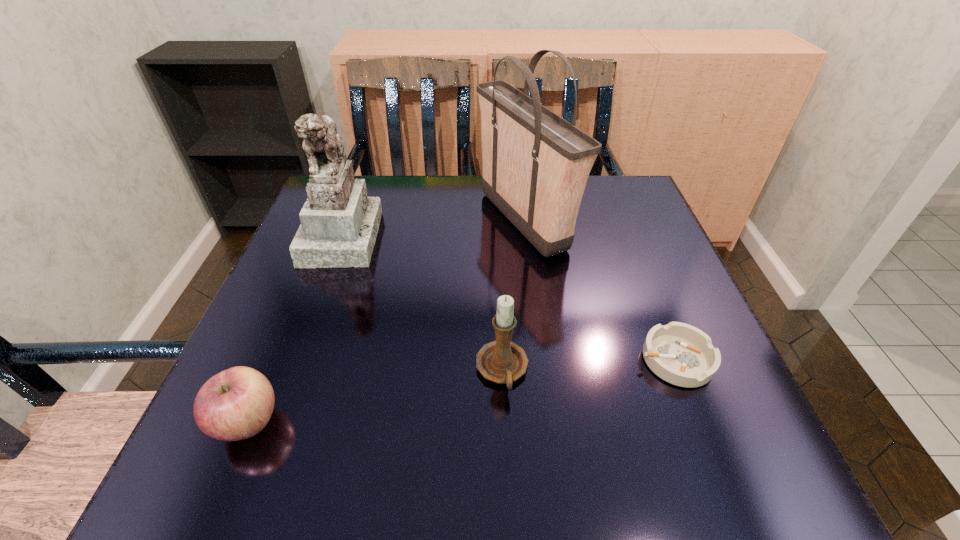
Image resolution: width=960 pixels, height=540 pixels. I want to click on free space located 0.080m on the front of the shortest object, so click(x=706, y=436).

Where is `shopping bag present at the far edge`? The height and width of the screenshot is (540, 960). shopping bag present at the far edge is located at coordinates point(536,164).

Where is `figurine located at the far edge`? The image size is (960, 540). figurine located at the far edge is located at coordinates [x=339, y=224].

I want to click on object that is at the near edge, so click(x=237, y=403).

You are a GUI agent. You are given a task and a screenshot of the screen. Output one action in this format:
    pyautogui.click(x=<x>, y=<y>)
    Task: Click on the figurine that is at the left edge
    
    Given the screenshot: What is the action you would take?
    pyautogui.click(x=339, y=224)

You are a GUI agent. You are given a task and a screenshot of the screen. Output one action in this format:
    pyautogui.click(x=<x>, y=<y>)
    Task: Click on the apple that is at the left edge
    The image size is (960, 540).
    Given the screenshot: What is the action you would take?
    pyautogui.click(x=237, y=403)

Locate an element on the screen. Image resolution: width=960 pixels, height=540 pixels. object that is positioned at the right edge is located at coordinates (683, 355).

Locate an element on the screen. The width and height of the screenshot is (960, 540). object that is at the far left corner is located at coordinates (339, 224).

Find the location of `object that is at the near left corner`. object that is at the near left corner is located at coordinates (237, 403).

At what (x,y) coordinates should I click in order to perform the action: click on vacant space at the far edge. Please return your answer as a coordinate pair (x, y). Looking at the image, I should click on (397, 192).